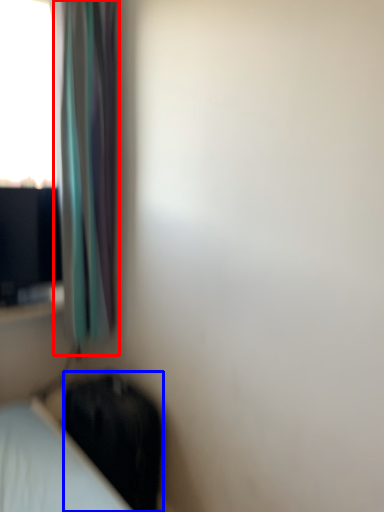
Question: Among these objects, which one is nearest to the camera, curtain (highlighted by a red box) or luggage (highlighted by a blue box)?

Choices:
 (A) curtain
 (B) luggage

Answer: (A)